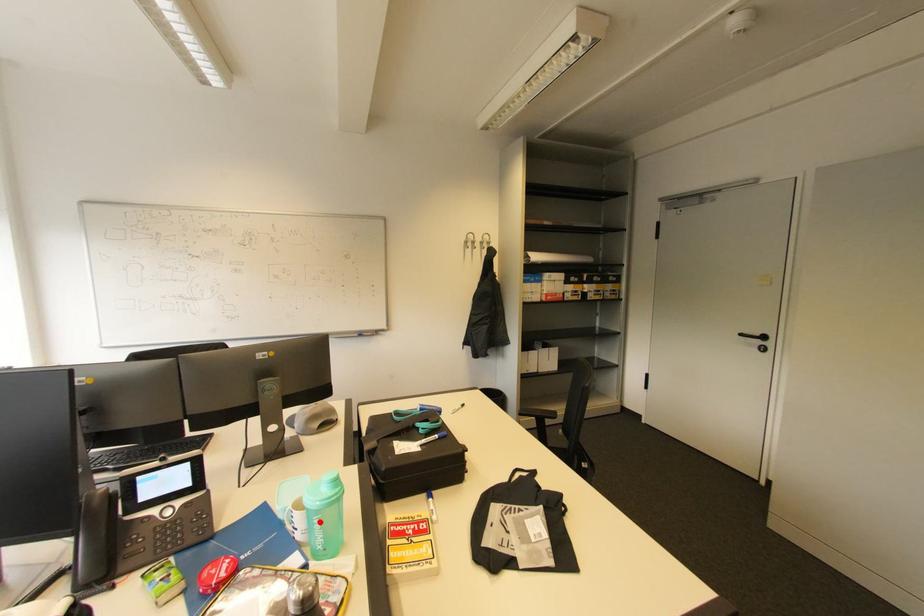
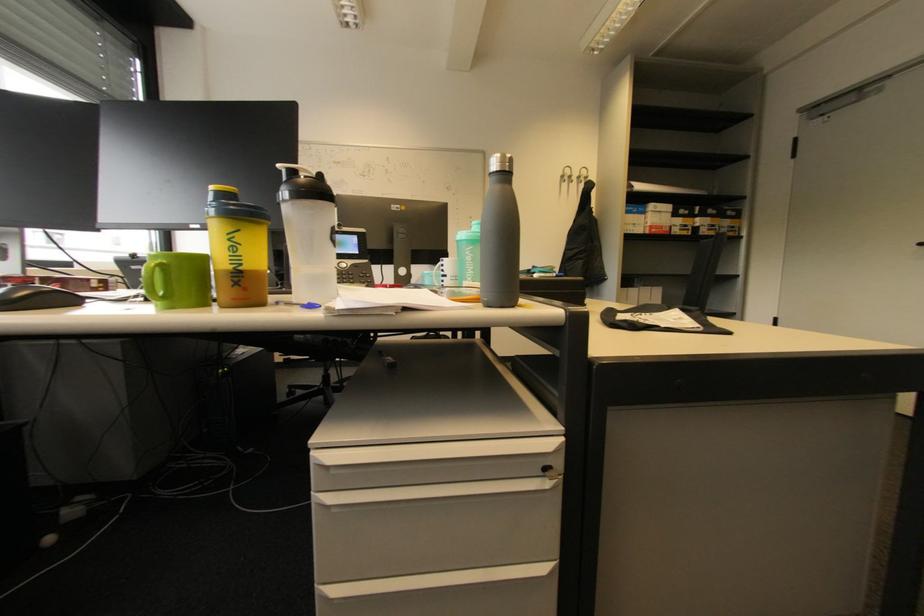
Find the pixel in the second image that matches the highlighted location in the first image.

(472, 254)